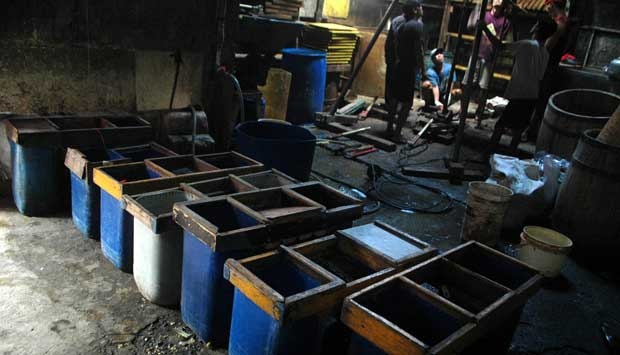
You are a GUI agent. You are given a task and a screenshot of the screen. Output one action in this format:
    pyautogui.click(x=<x>, y=<y>)
    Task: Click on the floor
    The image size is (620, 355).
    Given the screenshot: What is the action you would take?
    pyautogui.click(x=71, y=297)